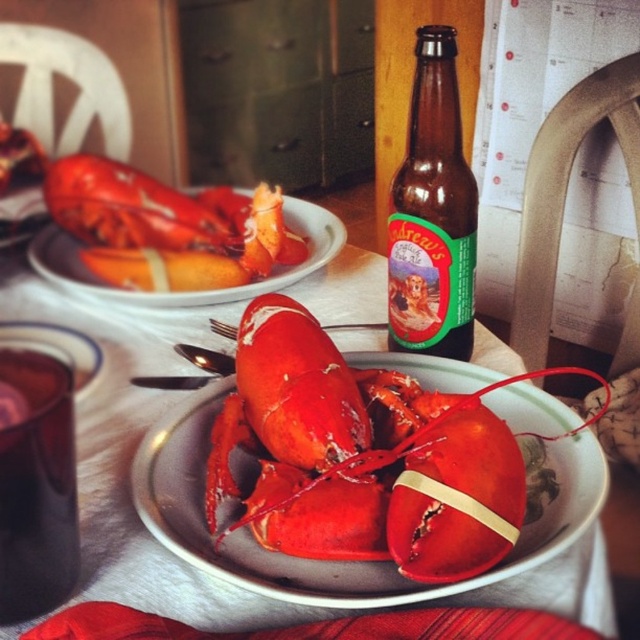
You are a chef arranging a lobster dinner. You need to place a decorative centerpiece exactly at the point marked by coordinates point (129, 488). However, there is already a matte ceramic plate at center. Can you place the centerpiece there without moving the existing plate?

The point marked by coordinates point (129, 488) is where the matte ceramic plate at center is located. Since the plate is already there, you cannot place the centerpiece at that exact spot without moving the existing plate.

You are a chef arranging a display for a seafood buffet. You need to place a decorative centerpiece exactly at the coordinate point 0.713, 0.577 on the table. However, there is already a shiny red lobster at center located at that spot. What should you do to avoid overlapping the lobster?

The shiny red lobster at center is already positioned at the coordinate point (369, 456), so you should choose a different location for the decorative centerpiece to avoid overlapping it.

You are a bartender preparing a drink and notice the brown glass bottle at center and the matte ceramic lobster at center on the table. Which object has a smaller width when viewed from above?

The brown glass bottle at center is thinner than the matte ceramic lobster at center, so the brown glass bottle at center has a smaller width when viewed from above.